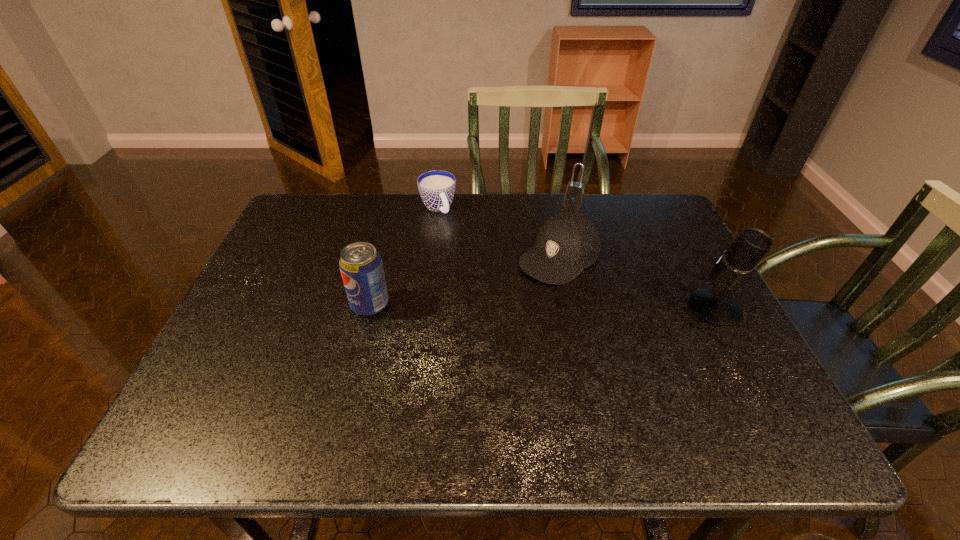
This screenshot has height=540, width=960. What are the coordinates of `cup that is at the far edge` in the screenshot? It's located at (437, 187).

Where is `padlock located in the far edge section of the desktop`? This screenshot has height=540, width=960. padlock located in the far edge section of the desktop is located at coordinates (575, 191).

Where is `object that is at the right edge`? This screenshot has height=540, width=960. object that is at the right edge is located at coordinates (716, 307).

Find the location of a particular element. The height and width of the screenshot is (540, 960). vacant point at the far edge is located at coordinates (570, 207).

In the image, there is a desktop. Identify the location of vacant region at the near edge. This screenshot has height=540, width=960. [x=467, y=379].

Where is `vacant space at the left edge of the desktop`? The height and width of the screenshot is (540, 960). vacant space at the left edge of the desktop is located at coordinates (272, 254).

Where is `vacant area at the right edge of the desktop`? vacant area at the right edge of the desktop is located at coordinates (688, 295).

Identify the location of vacant region at the far left corner of the desktop. (297, 203).

Where is `vacant area at the near right corner`? vacant area at the near right corner is located at coordinates (702, 380).

Find the location of `free space between the rightmost object and the soda`. free space between the rightmost object and the soda is located at coordinates (542, 306).